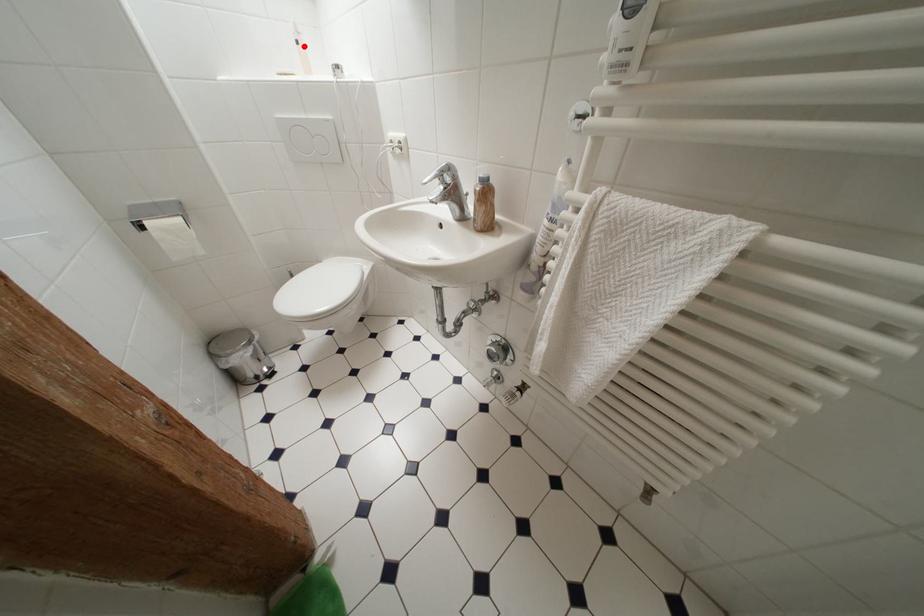
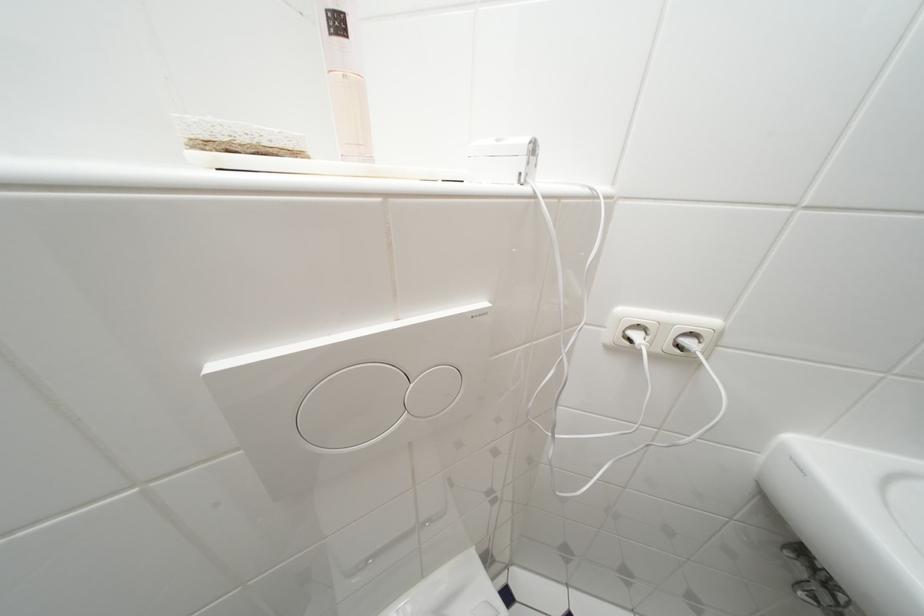
Where in the second image is the point corresponding to the highlighted location from the first image?

(345, 26)